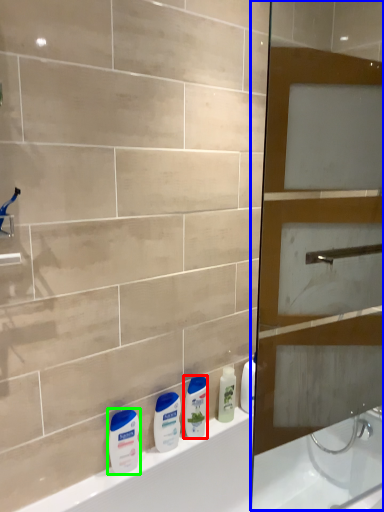
Question: Which object is positioned closest to cleaning product (highlighted by a red box)? Select from screen door (highlighted by a blue box) and toiletry (highlighted by a green box).

Choices:
 (A) screen door
 (B) toiletry

Answer: (B)